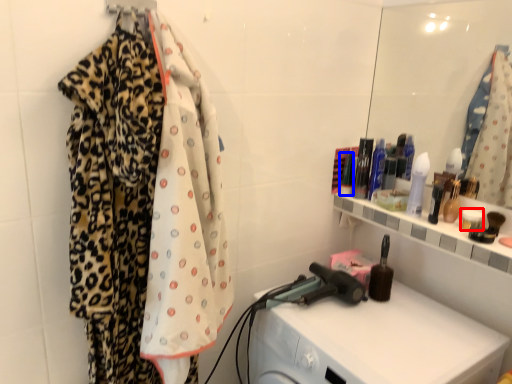
Question: Which object appears farthest to the camera in this image, toiletry (highlighted by a red box) or toiletry (highlighted by a blue box)?

Choices:
 (A) toiletry
 (B) toiletry

Answer: (B)